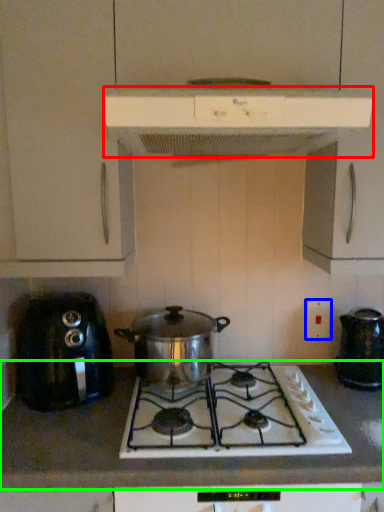
Question: Considering the real-world distances, which object is farthest from kitchen appliance (highlighted by a red box)? electric outlet (highlighted by a blue box) or countertop (highlighted by a green box)?

Choices:
 (A) electric outlet
 (B) countertop

Answer: (B)